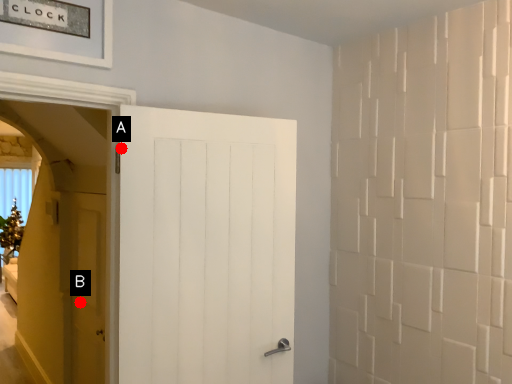
Question: Two points are circled on the image, labeled by A and B beside each circle. Which point is farther to the camera?

Choices:
 (A) A is further
 (B) B is further

Answer: (B)